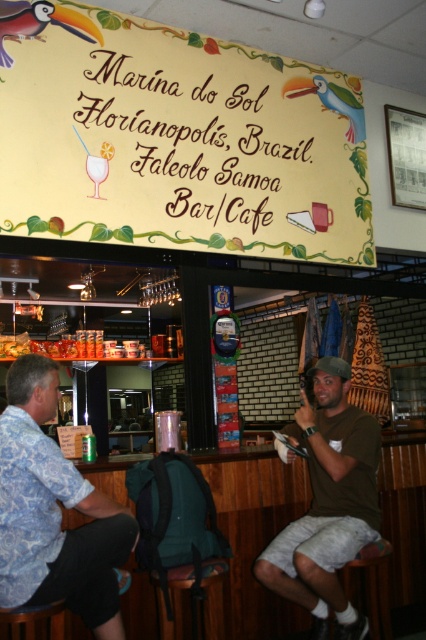
Does polished wood parrot at upper left have a greater width compared to blue glossy parrot at upper center?

Incorrect, polished wood parrot at upper left's width does not surpass blue glossy parrot at upper center's.

Does point (37, 16) lie behind point (340, 108)?

No, (37, 16) is in front of (340, 108).

Image resolution: width=426 pixels, height=640 pixels. What are the coordinates of `polished wood parrot at upper left` in the screenshot? It's located at (40, 22).

Identify the location of polished wood parrot at upper left. (40, 22).

Who is higher up, dark brown leather bar stool at lower center or blue glossy parrot at upper center?

blue glossy parrot at upper center is higher up.

From the picture: Measure the distance between point (219, 592) and camera.

They are 2.49 meters apart.

Where is `dark brown leather bar stool at lower center`? The image size is (426, 640). dark brown leather bar stool at lower center is located at coordinates (192, 600).

Between point (357, 516) and point (291, 86), which one is positioned behind?

The point (291, 86) is more distant.

The width and height of the screenshot is (426, 640). In order to click on green cotton t-shirt at center in this screenshot , I will do `click(328, 500)`.

Who is more forward, (325, 566) or (340, 92)?

Point (325, 566) is in front.

Identify the location of green cotton t-shirt at center. (328, 500).